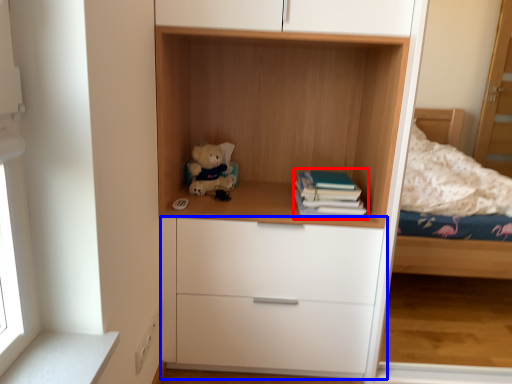
Question: Which object appears closest to the camera in this image, paperback book (highlighted by a red box) or chest of drawers (highlighted by a blue box)?

Choices:
 (A) paperback book
 (B) chest of drawers

Answer: (B)